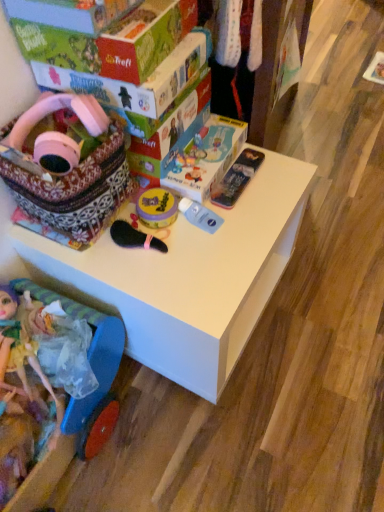
Where is `vacant area that is in front of yellow matte jar at center, the 4th toy positioned from the left`? The height and width of the screenshot is (512, 384). vacant area that is in front of yellow matte jar at center, the 4th toy positioned from the left is located at coordinates (172, 268).